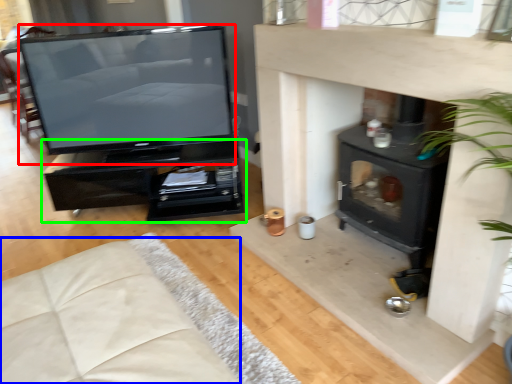
Question: Which object is the closest to the television (highlighted by a red box)? Choose among these: couch (highlighted by a blue box) or furniture (highlighted by a green box).

Choices:
 (A) couch
 (B) furniture

Answer: (B)